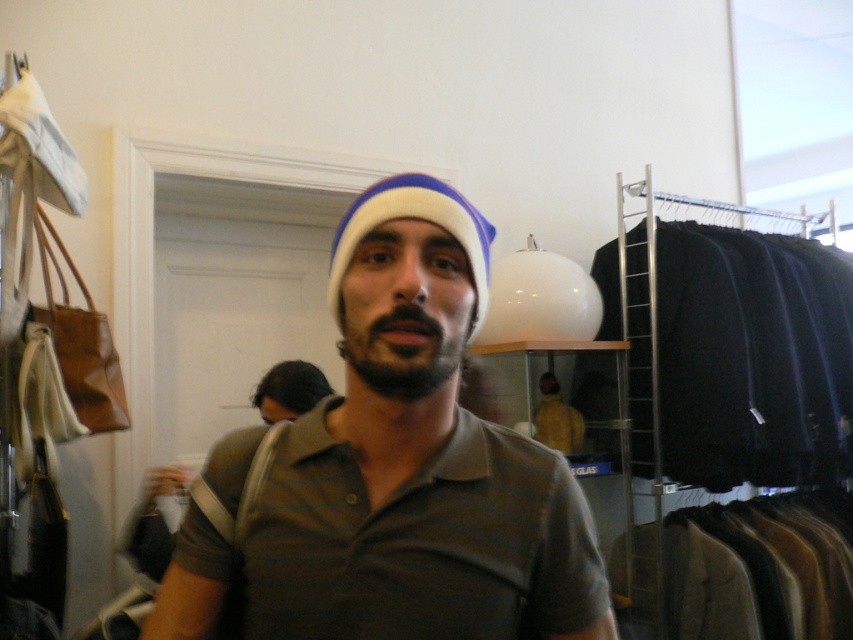
You are a customer in the clothing store and want to know if the brown striped polo shirt at center is located above or below the white knit beanie at center. Based on the scene, can you tell me their positions relative to each other?

The brown striped polo shirt at center is below the white knit beanie at center.

You are a customer in the clothing store and want to find the brown striped polo shirt at center. According to the store layout, where should you look relative to the other items?

The brown striped polo shirt at center is located at point 0.722 on the x axis and 0.489 on the y axis, so it is positioned in the center of the store.

You are a customer in a clothing store and want to know which item is shorter between the brown striped polo shirt at center and the black fabric at right. Can you tell me?

The brown striped polo shirt at center is shorter than the black fabric at right.